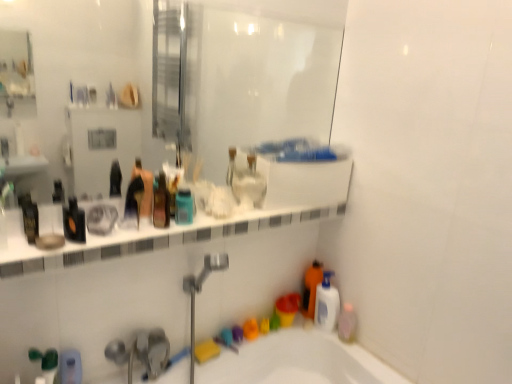
Question: Is pink translucent bottle at lower right, placed as the 2th mouthwash when sorted from back to front, to the right of translucent plastic mouthwash at center, which is the fourth mouthwash from right to left, from the viewer's perspective?

Choices:
 (A) yes
 (B) no

Answer: (A)

Question: Can you confirm if pink translucent bottle at lower right, which is the 1th mouthwash in right-to-left order, is thinner than translucent plastic mouthwash at center, the second mouthwash in the left-to-right sequence?

Choices:
 (A) yes
 (B) no

Answer: (B)

Question: Is pink translucent bottle at lower right, placed as the 2th mouthwash when sorted from back to front, wider than translucent plastic mouthwash at center, which appears as the 2th mouthwash when viewed from the front?

Choices:
 (A) yes
 (B) no

Answer: (A)

Question: Is pink translucent bottle at lower right, which is the 1th mouthwash in right-to-left order, smaller than translucent plastic mouthwash at center, positioned as the 4th mouthwash in back-to-front order?

Choices:
 (A) no
 (B) yes

Answer: (A)

Question: Can you confirm if pink translucent bottle at lower right, placed as the 2th mouthwash when sorted from back to front, is positioned to the left of translucent plastic mouthwash at center, which is the fourth mouthwash from right to left?

Choices:
 (A) no
 (B) yes

Answer: (A)

Question: From a real-world perspective, is matte plastic toothbrush at upper center, which is the 3th toiletry in left-to-right order, positioned above or below white glossy ledge at upper center?

Choices:
 (A) above
 (B) below

Answer: (A)

Question: In terms of size, does matte plastic toothbrush at upper center, positioned as the 1th toiletry in top-to-bottom order, appear bigger or smaller than white glossy ledge at upper center?

Choices:
 (A) small
 (B) big

Answer: (A)

Question: Would you say matte plastic toothbrush at upper center, which is the 3th toiletry in left-to-right order, is to the left or to the right of white glossy ledge at upper center in the picture?

Choices:
 (A) right
 (B) left

Answer: (B)

Question: Considering the positions of matte plastic toothbrush at upper center, the first toiletry viewed from the right, and white glossy ledge at upper center in the image, is matte plastic toothbrush at upper center, the first toiletry viewed from the right, taller or shorter than white glossy ledge at upper center?

Choices:
 (A) short
 (B) tall

Answer: (B)

Question: Based on their sizes in the image, would you say pink translucent bottle at lower right, placed as the 2th mouthwash when sorted from back to front, is bigger or smaller than matte black bottle at center, positioned as the 2th toiletry in bottom-to-top order?

Choices:
 (A) small
 (B) big

Answer: (A)

Question: From a real-world perspective, is pink translucent bottle at lower right, placed as the 2th mouthwash when sorted from back to front, above or below matte black bottle at center, positioned as the 2th toiletry in bottom-to-top order?

Choices:
 (A) below
 (B) above

Answer: (A)

Question: From the image's perspective, is pink translucent bottle at lower right, which is the 1th mouthwash in right-to-left order, located above or below matte black bottle at center, marked as the second toiletry in a right-to-left arrangement?

Choices:
 (A) below
 (B) above

Answer: (A)

Question: Considering the positions of point (347, 337) and point (132, 183), is point (347, 337) closer or farther from the camera than point (132, 183)?

Choices:
 (A) farther
 (B) closer

Answer: (A)

Question: Considering the positions of black glossy bottle at left, positioned as the 5th mouthwash in right-to-left order, and white glossy ledge at upper center in the image, is black glossy bottle at left, positioned as the 5th mouthwash in right-to-left order, bigger or smaller than white glossy ledge at upper center?

Choices:
 (A) big
 (B) small

Answer: (B)

Question: Looking at their shapes, would you say black glossy bottle at left, positioned as the 5th mouthwash in right-to-left order, is wider or thinner than white glossy ledge at upper center?

Choices:
 (A) wide
 (B) thin

Answer: (B)